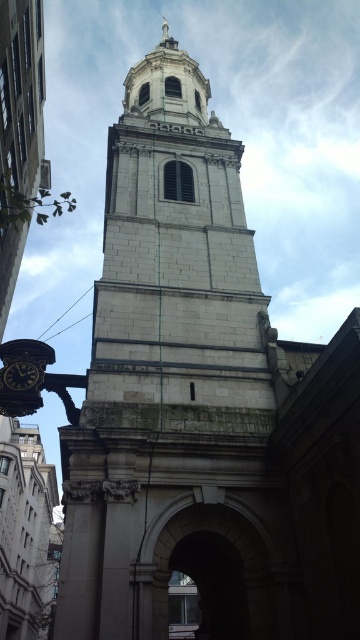
You are standing in front of the historic stone tower. You notice two points marked on the tower wall. One is at coordinate point (150, 568) and the other at point (27, 390). Which of these two points is closer to you?

Point (150, 568) is in front of point (27, 390), so it is closer to you.

You are an architect examining the historic stone tower. You notice the stone archway at center and the black glossy clock at lower left. Based on their positions, which object is located higher up on the tower?

The stone archway at center is positioned under the black glossy clock at lower left, meaning the black glossy clock at lower left is higher up on the tower.